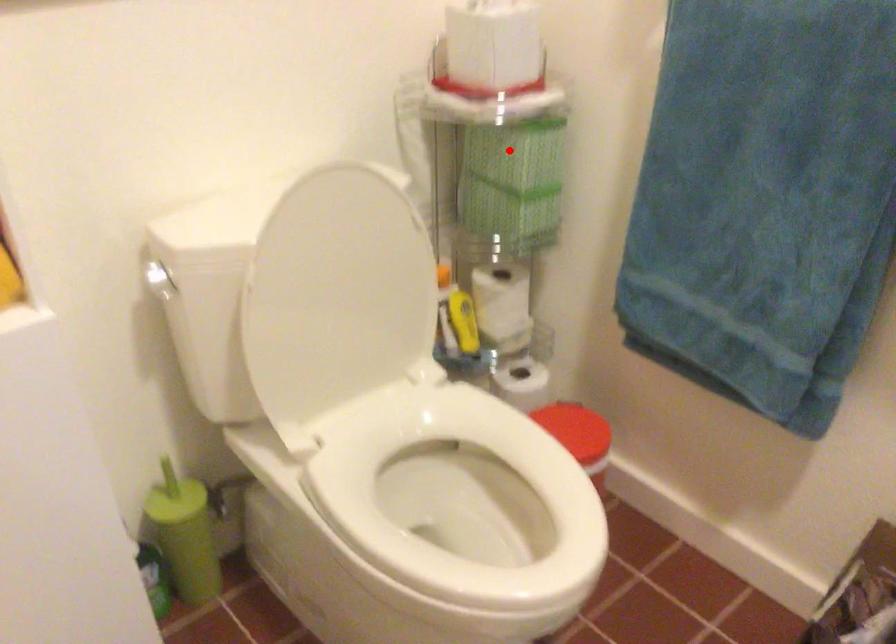
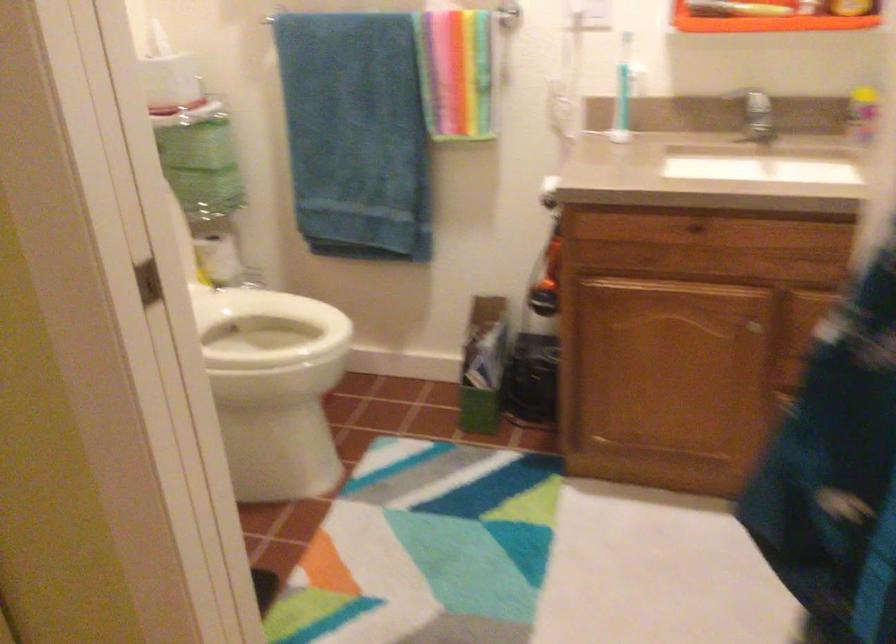
Question: A red point is marked in image1. In image2, is the corresponding 3D point closer to the camera or farther? Reply with the corresponding letter.

Choices:
 (A) The corresponding 3D point is closer.
 (B) The corresponding 3D point is farther.

Answer: (B)